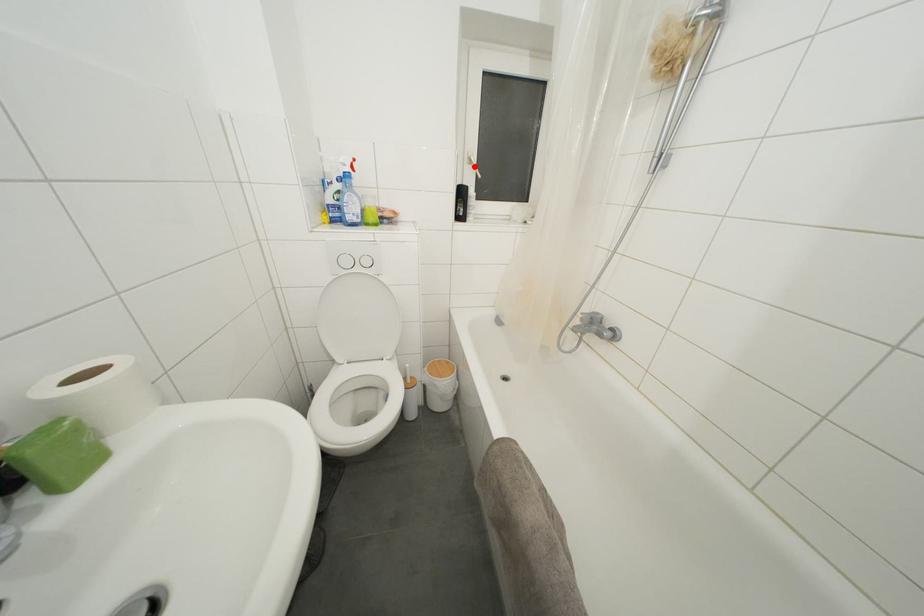
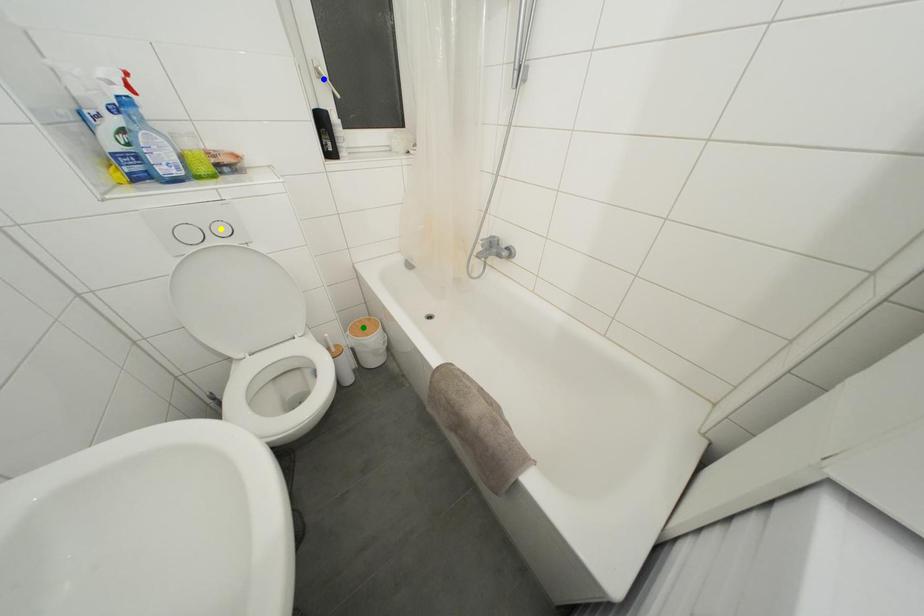
Question: I am providing you with two images of the same scene from different viewpoints. A red point is marked on the first image. You are given multiple points on the second image. Which point in image 2 is actually the same real-world point as the red point in image 1?

Choices:
 (A) blue point
 (B) yellow point
 (C) green point

Answer: (A)